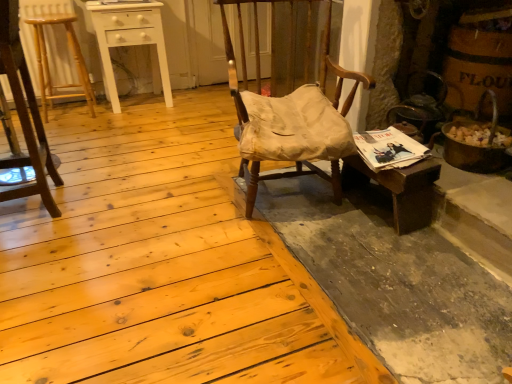
In order to click on free space between light brown wood bar stool at left and white wood table at upper left in this screenshot , I will do `click(100, 112)`.